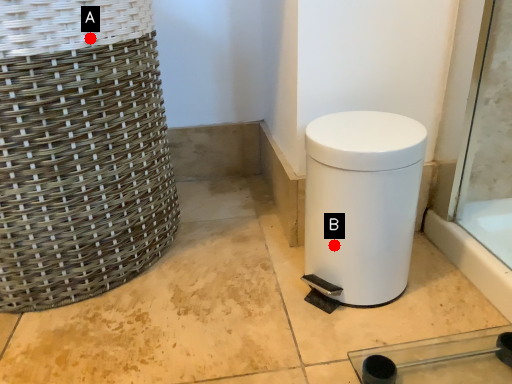
Question: Two points are circled on the image, labeled by A and B beside each circle. Which point is further to the camera?

Choices:
 (A) A is further
 (B) B is further

Answer: (B)